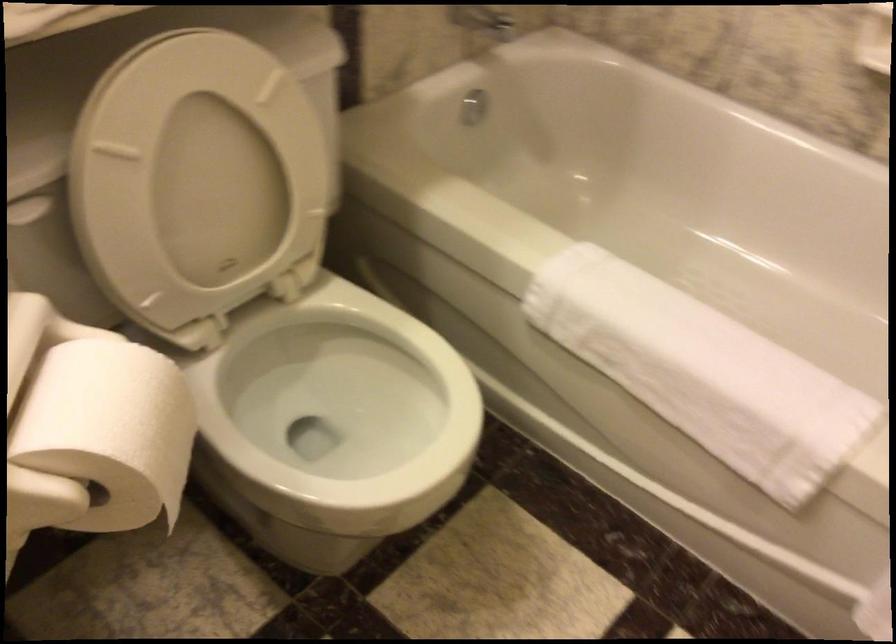
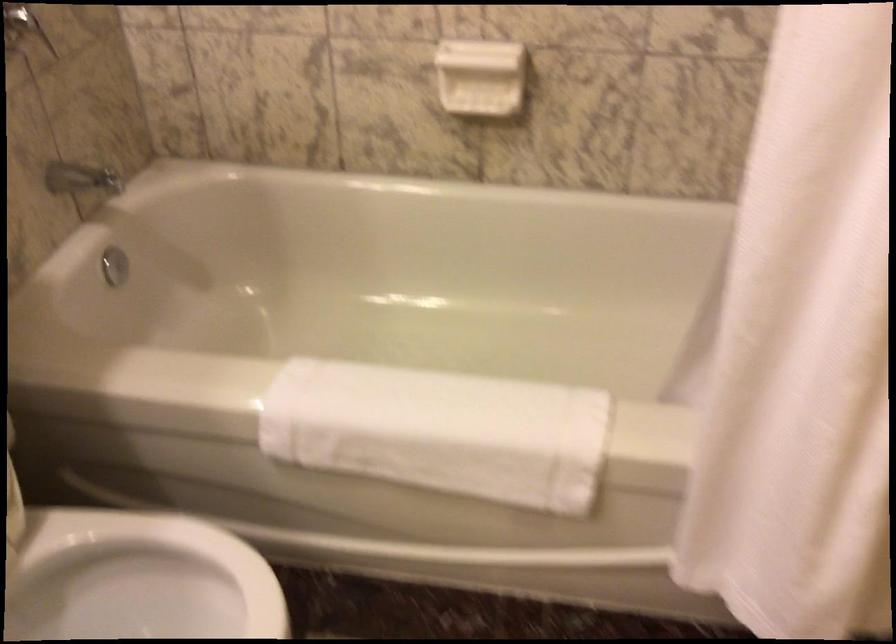
Where in the second image is the point corresponding to pixel 686 361 from the first image?

(440, 431)